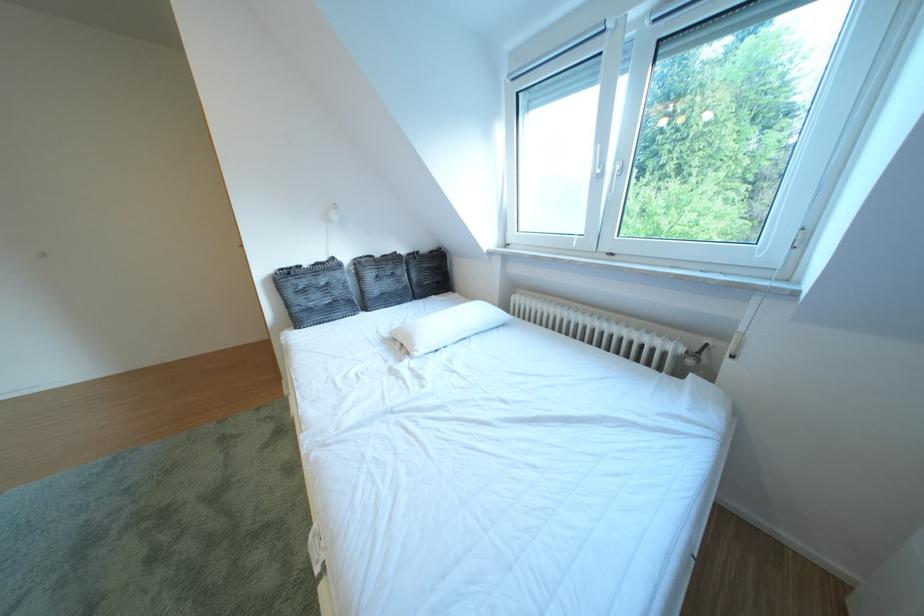
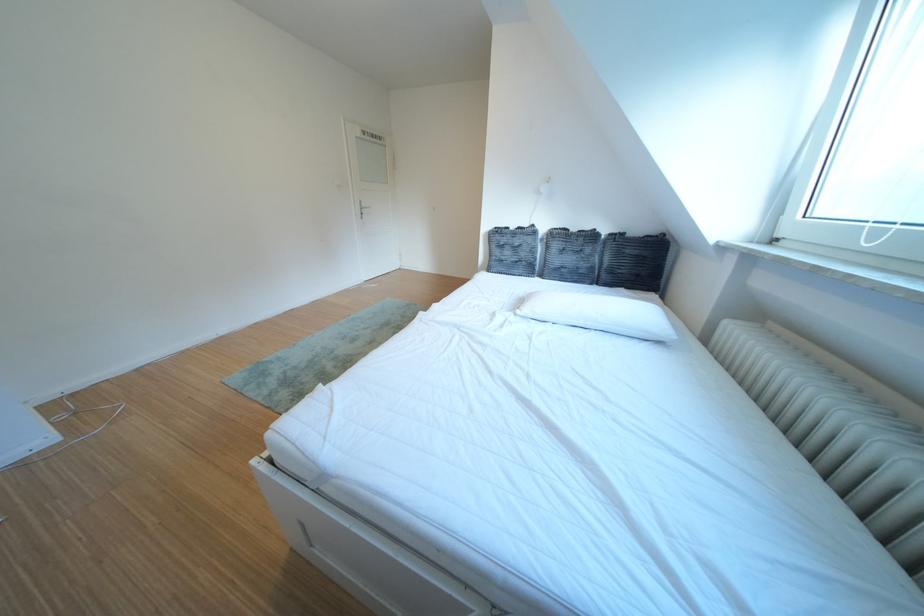
Question: The camera is either moving clockwise (left) or counter-clockwise (right) around the object. The first image is from the beginning of the video and the second image is from the end. Is the camera moving left or right when shooting the video?

Choices:
 (A) Left
 (B) Right

Answer: (B)